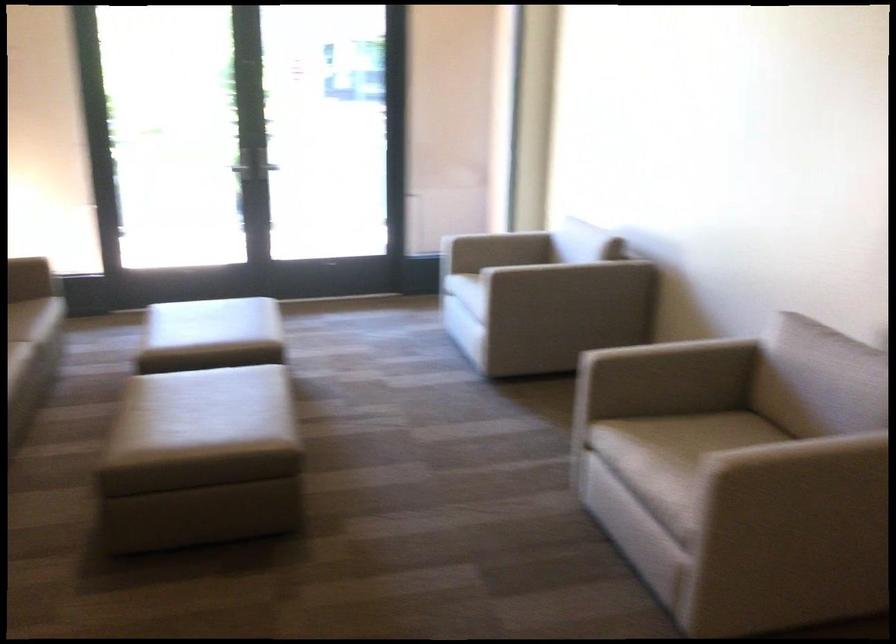
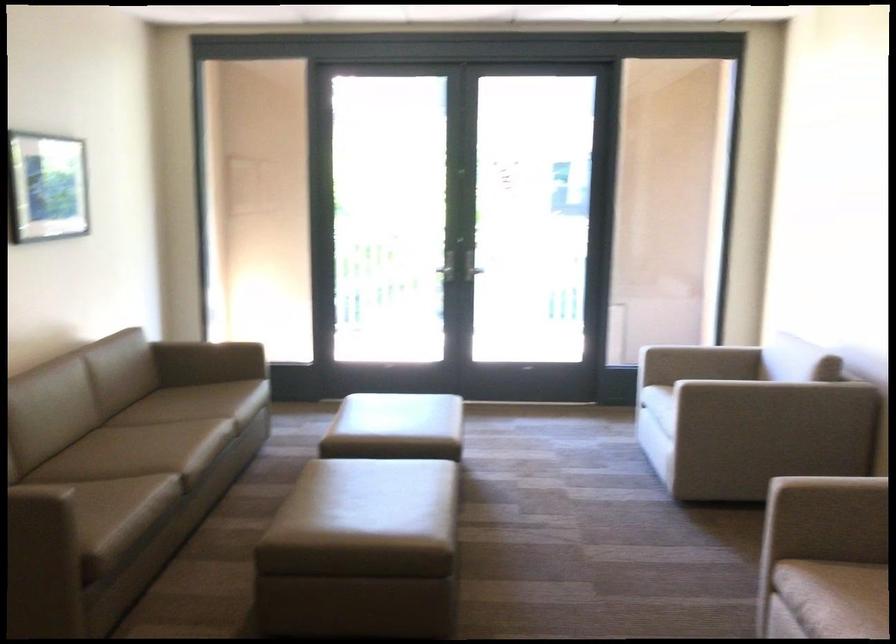
The point at [234,166] is marked in the first image. Where is the corresponding point in the second image?

(444, 270)